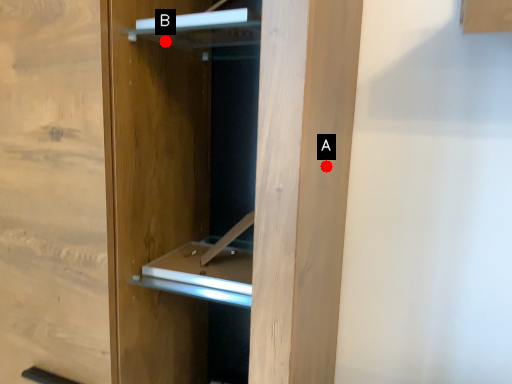
Question: Two points are circled on the image, labeled by A and B beside each circle. Which point is closer to the camera?

Choices:
 (A) A is closer
 (B) B is closer

Answer: (A)